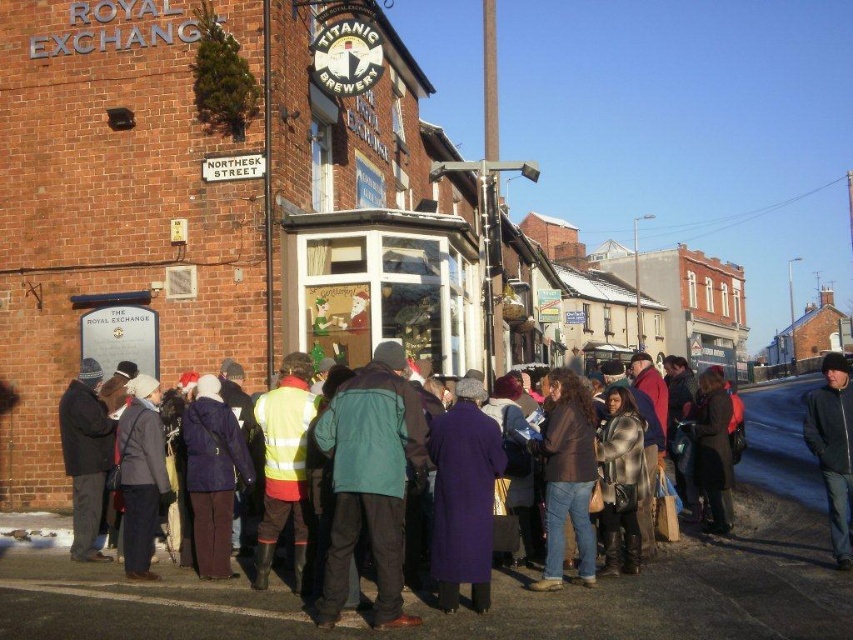
You are a photographer trying to capture a photo of the group of people in front of the Royal Exchange. You notice two jackets in the center of the image, a matte green jacket at center and a dark brown leather jacket at center. Which jacket is positioned lower in the frame?

The matte green jacket at center is below the dark brown leather jacket at center, so it is positioned lower in the frame.

You are standing in the cold winter scene outside the Royal Exchange. You see a purple wool coat at center and a dark brown leather jacket at center. Which person is closer to the entrance of the Titanic Brewery?

The purple wool coat at center is closer to the entrance of the Titanic Brewery because it is in front of the dark brown leather jacket at center in the queue.